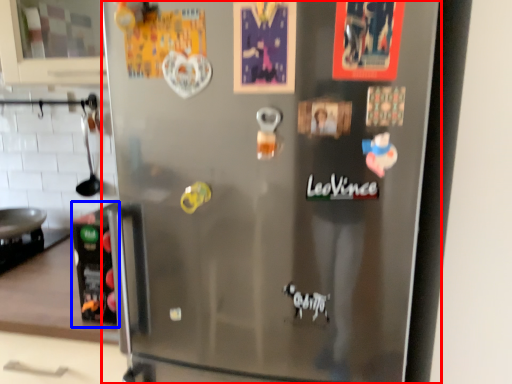
Question: Which object appears farthest to the camera in this image, refrigerator (highlighted by a red box) or appliance (highlighted by a blue box)?

Choices:
 (A) refrigerator
 (B) appliance

Answer: (B)